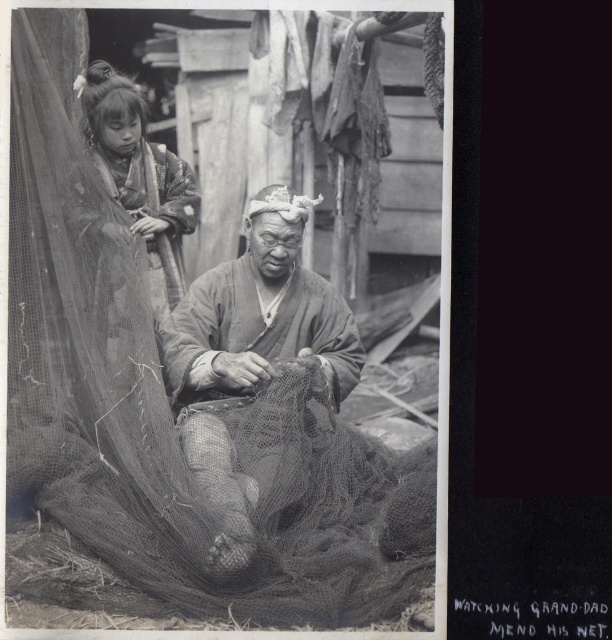
Does point (121, 403) come closer to viewer compared to point (102, 172)?

Yes, it is in front of point (102, 172).

Does coarse mesh net at center appear under smooth fabric kimono at upper left?

Yes, coarse mesh net at center is below smooth fabric kimono at upper left.

The image size is (612, 640). In order to click on coarse mesh net at center in this screenshot , I will do `click(165, 417)`.

Can you confirm if matte fabric man at center is bigger than smooth fabric kimono at upper left?

Yes, matte fabric man at center is bigger than smooth fabric kimono at upper left.

Can you confirm if matte fabric man at center is positioned to the right of smooth fabric kimono at upper left?

Yes, matte fabric man at center is to the right of smooth fabric kimono at upper left.

Describe the element at coordinates (250, 353) in the screenshot. This screenshot has width=612, height=640. I see `matte fabric man at center` at that location.

Where is `matte fabric man at center`? matte fabric man at center is located at coordinates (250, 353).

Between coarse mesh net at center and matte fabric man at center, which one has less height?

With less height is matte fabric man at center.

Does coarse mesh net at center come in front of matte fabric man at center?

No, coarse mesh net at center is behind matte fabric man at center.

Is point (308, 536) closer to camera compared to point (230, 541)?

No, it is not.

Image resolution: width=612 pixels, height=640 pixels. In order to click on coarse mesh net at center in this screenshot , I will do `click(165, 417)`.